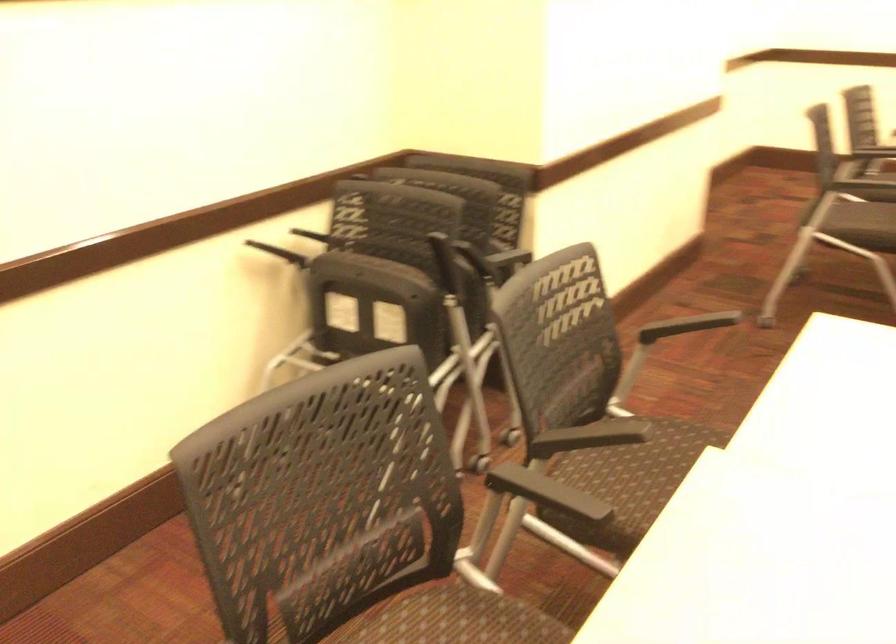
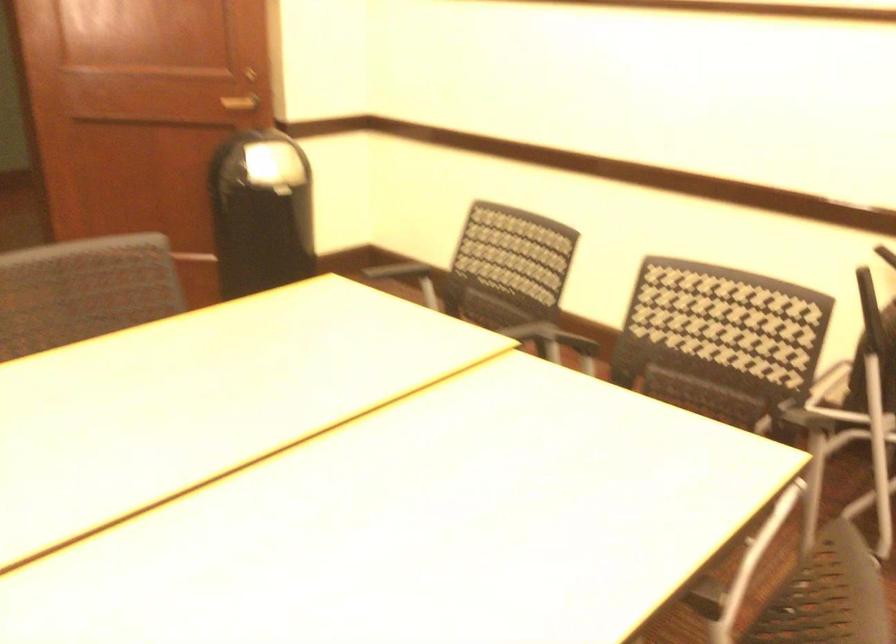
Locate, in the second image, the point that corresponds to point (700, 527) in the first image.

(446, 332)